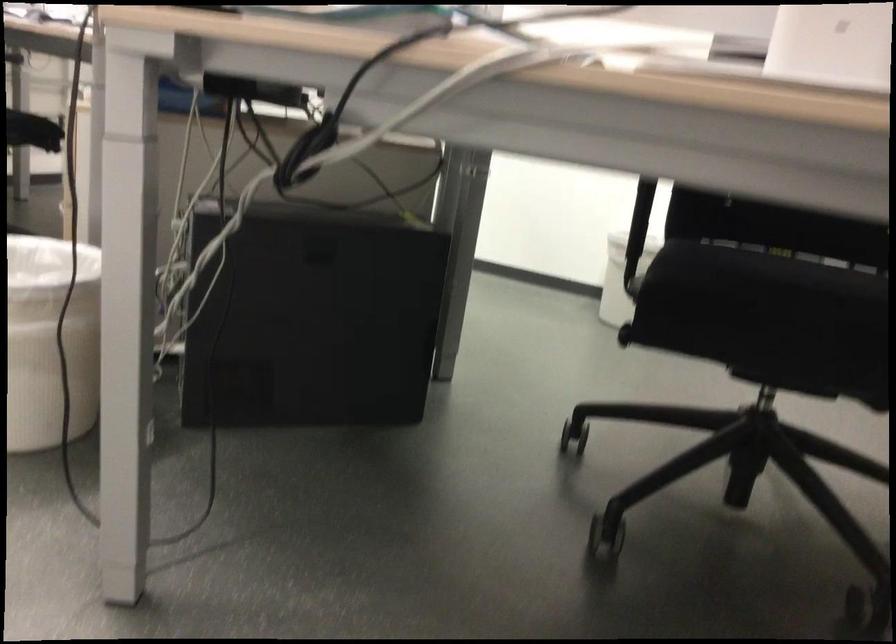
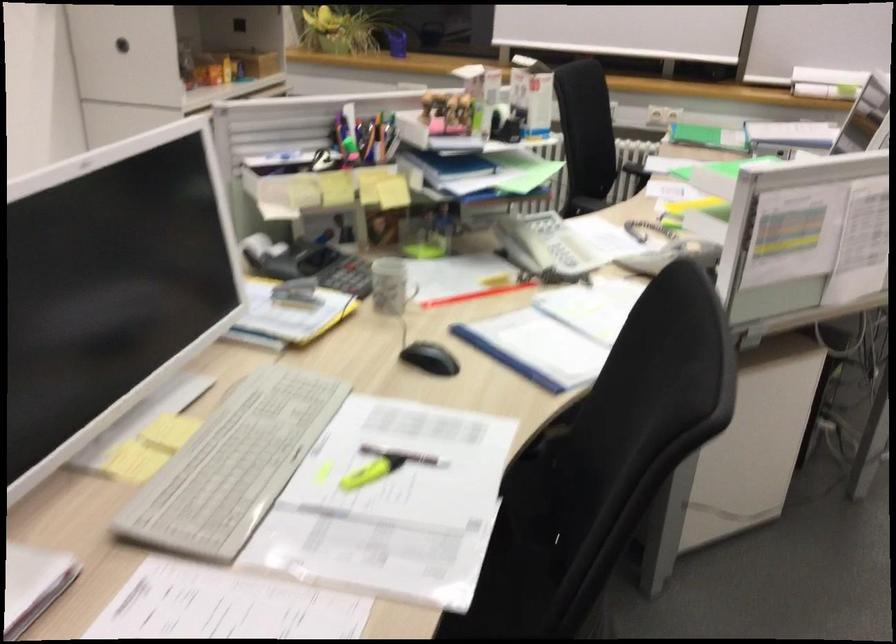
Find the pixel in the second image that matches [692,243] in the first image.

(518, 554)